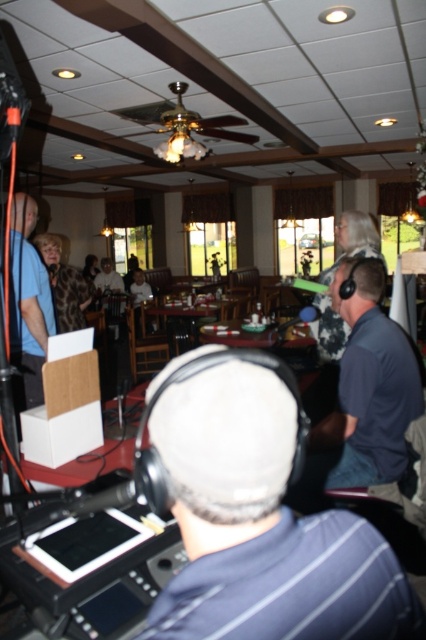
Does dark gray fabric headphones at center have a lesser width compared to dark blue shirt at center?

Yes, dark gray fabric headphones at center is thinner than dark blue shirt at center.

Is point (215, 556) positioned before point (354, 257)?

Yes, point (215, 556) is in front of point (354, 257).

The height and width of the screenshot is (640, 426). In order to click on dark gray fabric headphones at center in this screenshot , I will do `click(261, 524)`.

Consider the image. Is dark gray fabric headphones at center below matte blue shirt at left?

Indeed, dark gray fabric headphones at center is positioned under matte blue shirt at left.

Describe the element at coordinates (261, 524) in the screenshot. I see `dark gray fabric headphones at center` at that location.

Find the location of a particular element. This screenshot has width=426, height=640. dark gray fabric headphones at center is located at coordinates (261, 524).

Is dark blue shirt at center above matte blue shirt at left?

Actually, dark blue shirt at center is below matte blue shirt at left.

Is dark blue shirt at center below matte blue shirt at left?

Indeed, dark blue shirt at center is positioned under matte blue shirt at left.

Who is more forward, (397, 408) or (13, 211)?

Point (397, 408)

At what (x,y) coordinates should I click in order to perform the action: click on dark blue shirt at center. Please return your answer as a coordinate pair (x, y). Looking at the image, I should click on (370, 384).